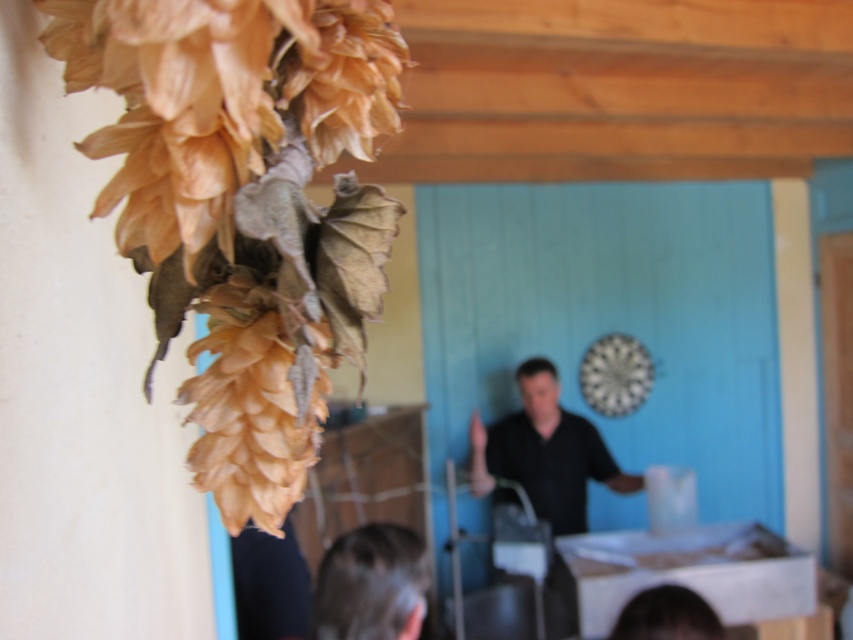
You are standing in a rustic wooden structure where dried hop cones are hanging from a string at the top left. You notice a person with dark brown hair at lower center. If you want to approach the person, which direction should you move relative to the string of hop cones?

The dark brown hair at lower center is located at point 0.914 on the x and 0.436 on the y axis. Since the string of hop cones is at the top left corner, moving towards the lower center direction would take you closer to the person without interfering with the hanging hops.

You are a delivery person who just arrived to drop off a package. The package is 36 inches long. You see the white cardboard box at lower center and the matte black shirt at center. Can you fit the package between them?

The distance between the white cardboard box at lower center and the matte black shirt at center is 35.37 inches. Since the package is 36 inches long, it cannot fit between them as the space is slightly smaller than the package.